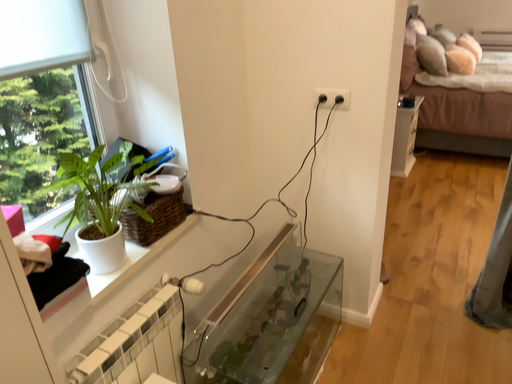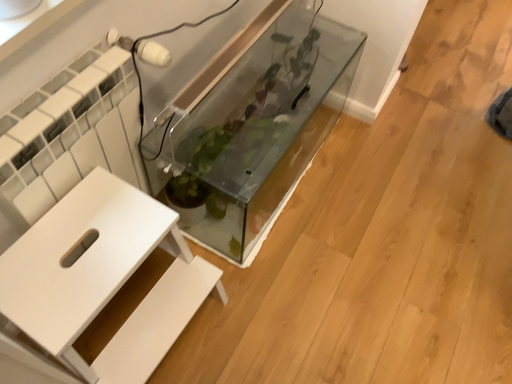
Question: Which way did the camera rotate in the video?

Choices:
 (A) rotated upward
 (B) rotated downward

Answer: (B)